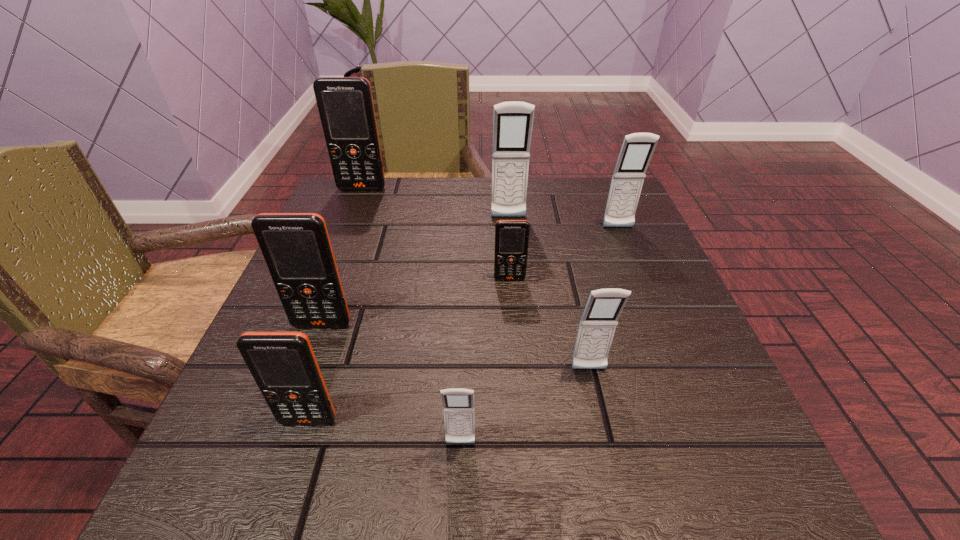
Find the location of a particular element. The height and width of the screenshot is (540, 960). free space located 0.060m on the front-facing side of the sixth farthest cellular telephone is located at coordinates (598, 410).

The image size is (960, 540). Identify the location of free space located 0.110m on the screen of the second smallest orange cellular telephone. (279, 510).

This screenshot has height=540, width=960. What are the coordinates of `vacant point located 0.190m on the screen of the fourth farthest cellular telephone` in the screenshot? It's located at (516, 361).

Locate an element on the screen. vacant space situated 0.080m on the front-facing side of the fourth object from left to right is located at coordinates (458, 513).

Identify the location of object that is positioned at the near edge. (458, 404).

Find the location of a particular element. This screenshot has width=960, height=540. object situated at the right edge is located at coordinates (637, 149).

Image resolution: width=960 pixels, height=540 pixels. Identify the location of object positioned at the far left corner. (345, 104).

Image resolution: width=960 pixels, height=540 pixels. Identify the location of object that is positioned at the far right corner. (637, 149).

The height and width of the screenshot is (540, 960). In the image, there is a desktop. What are the coordinates of `vacant space at the far edge` in the screenshot? It's located at pos(463,219).

Where is `vacant space at the near edge of the desktop`? Image resolution: width=960 pixels, height=540 pixels. vacant space at the near edge of the desktop is located at coordinates click(395, 492).